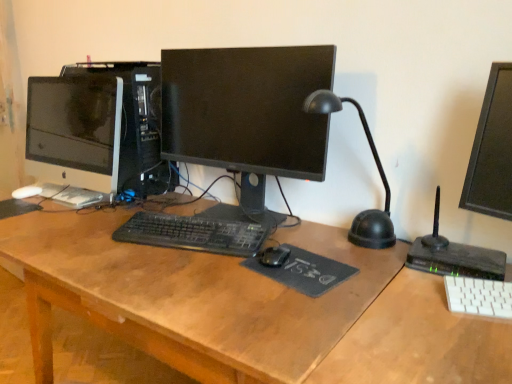
Where is `vacant space that's between black matte keyboard at center, which is counted as the second computer keyboard, starting from the front, and black rubber mousepad at center, which appears as the 2th mousepad when viewed from the right`? vacant space that's between black matte keyboard at center, which is counted as the second computer keyboard, starting from the front, and black rubber mousepad at center, which appears as the 2th mousepad when viewed from the right is located at coordinates (68, 217).